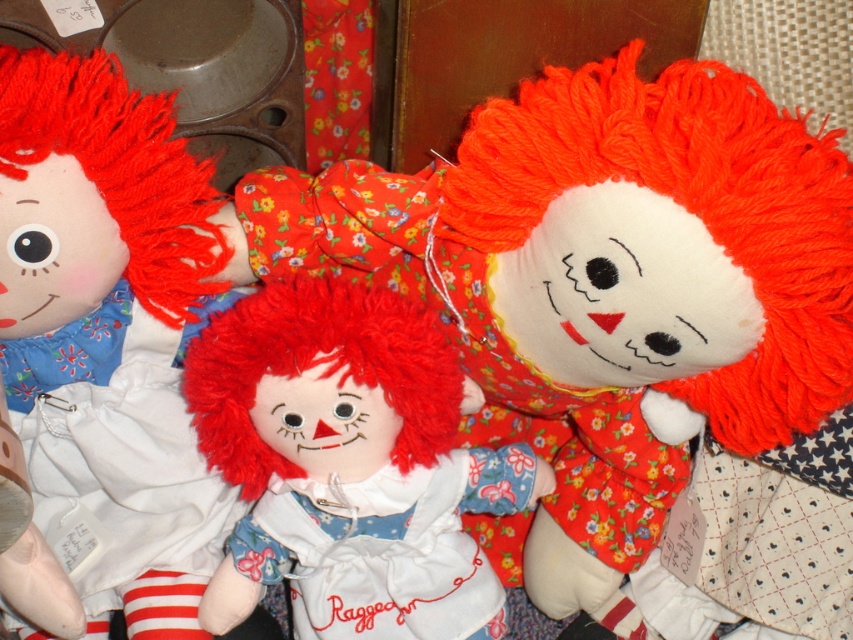
In the scene shown: You are trying to place the white soft doll at left and the fluffy red hair doll at center into a small gift box. The box can only fit one doll at a time. Based on their sizes, which doll would you choose to place first into the box to ensure it fits properly?

The fluffy red hair doll at center is smaller in size compared to the white soft doll at left, so it can fit into the box first.

You are a child playing with the dolls and want to place the white soft doll at left and the fluffy red hair doll at center on a small shelf. Which doll should you place first to ensure they both fit on the shelf?

The white soft doll at left should be placed first because it is above the fluffy red hair doll at center, indicating it requires more vertical space.